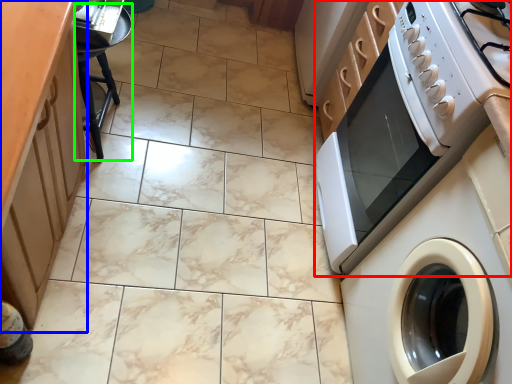
Question: Which is farther away from home appliance (highlighted by a red box)? cabinetry (highlighted by a blue box) or stool (highlighted by a green box)?

Choices:
 (A) cabinetry
 (B) stool

Answer: (B)